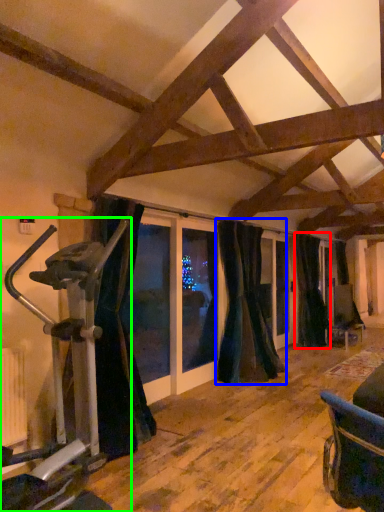
Question: Based on their relative distances, which object is farther from curtain (highlighted by a red box)? Choose from curtain (highlighted by a blue box) and stationary bicycle (highlighted by a green box).

Choices:
 (A) curtain
 (B) stationary bicycle

Answer: (B)